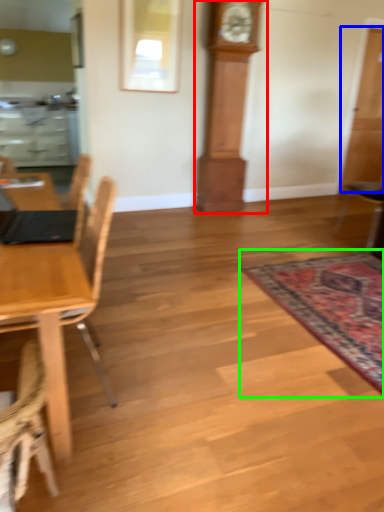
Question: Which object is the farthest from clock (highlighted by a red box)? Choose among these: glass door (highlighted by a blue box) or mat (highlighted by a green box).

Choices:
 (A) glass door
 (B) mat

Answer: (B)